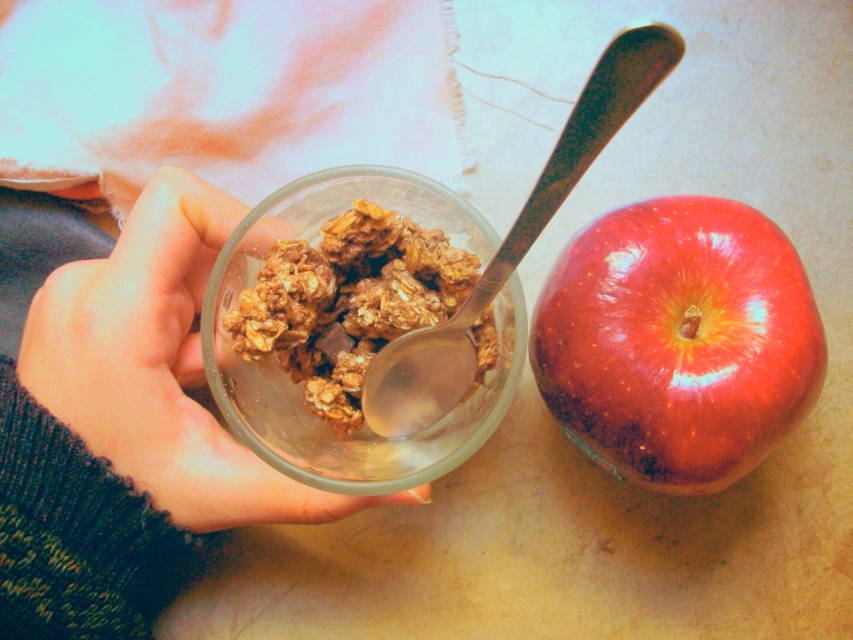
You are setting up a healthy breakfast tray and need to arrange the translucent plastic cup at center and the golden crunchy granola at center. According to the image, where should the cup be placed relative to the granola?

The translucent plastic cup at center should be placed under the golden crunchy granola at center as it is positioned under it in the image.

What are the coordinates of the translucent plastic cup at center in the image?

The translucent plastic cup at center is located at coordinates point (160, 368).